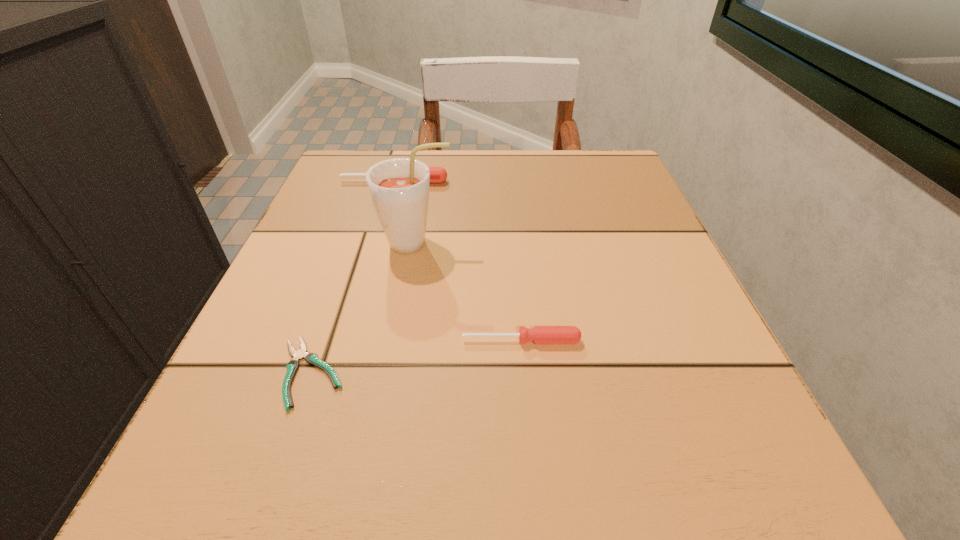
Where is `free space at the far left corner of the desktop`? This screenshot has width=960, height=540. free space at the far left corner of the desktop is located at coordinates (360, 152).

At what (x,y) coordinates should I click in order to perform the action: click on free space at the far right corner of the desktop. Please return your answer as a coordinate pair (x, y). The height and width of the screenshot is (540, 960). Looking at the image, I should click on (568, 159).

Locate an element on the screen. The image size is (960, 540). vacant space at the near right corner of the desktop is located at coordinates (724, 444).

Identify the location of free area in between the farther screwdriver and the shorter screwdriver. (458, 261).

Identify the location of free space between the taller screwdriver and the nearer screwdriver. Image resolution: width=960 pixels, height=540 pixels. (458, 261).

I want to click on free area in between the pliers and the root beer, so click(x=364, y=308).

Where is `unoccupied area between the shortest object and the third tallest object`? The image size is (960, 540). unoccupied area between the shortest object and the third tallest object is located at coordinates (417, 356).

Identify the location of free point between the nearer screwdriver and the farthest object. Image resolution: width=960 pixels, height=540 pixels. (458, 261).

What are the coordinates of `free space between the taller screwdriver and the second shortest object` in the screenshot? It's located at (458, 261).

This screenshot has width=960, height=540. In order to click on free space between the rightmost object and the farthest object in this screenshot , I will do `click(458, 261)`.